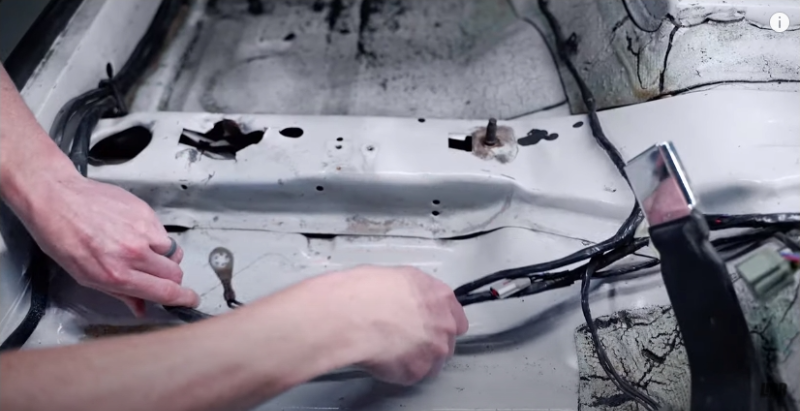
The height and width of the screenshot is (411, 800). What are the coordinates of `wires` in the screenshot? It's located at (581, 254), (586, 303).